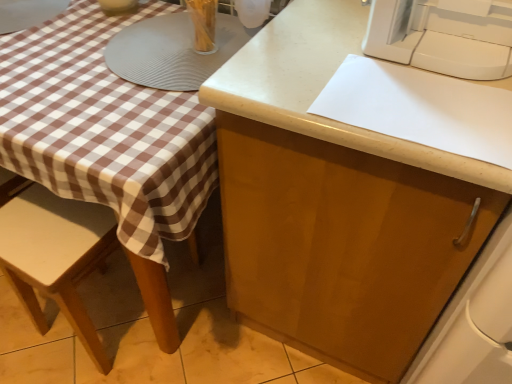
Locate an element on the screen. This screenshot has height=384, width=512. wooden chair at lower left is located at coordinates (55, 254).

What do you see at coordinates (342, 245) in the screenshot? Image resolution: width=512 pixels, height=384 pixels. I see `matte wood cabinet at center` at bounding box center [342, 245].

You are a GUI agent. You are given a task and a screenshot of the screen. Output one action in this format:
    pyautogui.click(x=<x>, y=<y>)
    Task: Click on the matte wood cabinet at center
    
    Given the screenshot: What is the action you would take?
    pyautogui.click(x=342, y=245)

Locate an element on the screen. Image resolution: width=512 pixels, height=384 pixels. white plastic sewing machine at upper right is located at coordinates (441, 38).

Is matte wood cabinet at center situated inside wooden chair at lower left or outside?

matte wood cabinet at center lies outside wooden chair at lower left.

Is matte wood cabinet at center at the right side of wooden chair at lower left?

Correct, you'll find matte wood cabinet at center to the right of wooden chair at lower left.

Are matte wood cabinet at center and wooden chair at lower left far apart?

No, there isn't a large distance between matte wood cabinet at center and wooden chair at lower left.

Is matte wood cabinet at center oriented towards wooden chair at lower left?

No, matte wood cabinet at center is not aimed at wooden chair at lower left.

Is wooden chair at lower left next to white plastic sewing machine at upper right?

wooden chair at lower left and white plastic sewing machine at upper right are clearly separated.

Is point (38, 329) positioned in front of point (389, 9)?

No.

Considering the relative sizes of wooden chair at lower left and white plastic sewing machine at upper right in the image provided, is wooden chair at lower left smaller than white plastic sewing machine at upper right?

Actually, wooden chair at lower left might be larger than white plastic sewing machine at upper right.

Between matte wood cabinet at center and white plastic sewing machine at upper right, which one has larger size?

Bigger between the two is matte wood cabinet at center.

Looking at this image, from a real-world perspective, is matte wood cabinet at center above or below white plastic sewing machine at upper right?

From a real-world perspective, matte wood cabinet at center is physically below white plastic sewing machine at upper right.

Is point (438, 204) behind point (480, 42)?

No, (438, 204) is in front of (480, 42).

The image size is (512, 384). Find the location of `sewing machine on the right of matte wood cabinet at center`. sewing machine on the right of matte wood cabinet at center is located at coordinates (441, 38).

Is white plastic sewing machine at upper right not near matte wood cabinet at center?

white plastic sewing machine at upper right is actually quite close to matte wood cabinet at center.

Considering the relative positions of white plastic sewing machine at upper right and matte wood cabinet at center in the image provided, is white plastic sewing machine at upper right to the left or to the right of matte wood cabinet at center?

Based on their positions, white plastic sewing machine at upper right is located to the right of matte wood cabinet at center.

Is white plastic sewing machine at upper right facing towards matte wood cabinet at center?

No, white plastic sewing machine at upper right is not turned towards matte wood cabinet at center.

In terms of width, does white plastic sewing machine at upper right look wider or thinner when compared to matte wood cabinet at center?

In the image, white plastic sewing machine at upper right appears to be more narrow than matte wood cabinet at center.

Considering the sizes of objects white plastic sewing machine at upper right and wooden chair at lower left in the image provided, who is shorter, white plastic sewing machine at upper right or wooden chair at lower left?

With less height is white plastic sewing machine at upper right.

Considering the relative positions of white plastic sewing machine at upper right and wooden chair at lower left in the image provided, is white plastic sewing machine at upper right to the left or to the right of wooden chair at lower left?

Clearly, white plastic sewing machine at upper right is on the right of wooden chair at lower left in the image.

From a real-world perspective, is white plastic sewing machine at upper right below wooden chair at lower left?

No.

Is wooden chair at lower left bigger or smaller than matte wood cabinet at center?

Clearly, wooden chair at lower left is smaller in size than matte wood cabinet at center.

Between wooden chair at lower left and matte wood cabinet at center, which one has larger width?

matte wood cabinet at center is wider.

From the image's perspective, is wooden chair at lower left over matte wood cabinet at center?

No, from the image's perspective, wooden chair at lower left is not above matte wood cabinet at center.

From a real-world perspective, is wooden chair at lower left on matte wood cabinet at center?

Actually, wooden chair at lower left is physically below matte wood cabinet at center in the real world.

This screenshot has width=512, height=384. What are the coordinates of `chair on the left side of matte wood cabinet at center` in the screenshot? It's located at (55, 254).

Identify the location of sewing machine that appears on the right of wooden chair at lower left. (441, 38).

Based on their spatial positions, is wooden chair at lower left or matte wood cabinet at center further from white plastic sewing machine at upper right?

Based on the image, wooden chair at lower left appears to be further to white plastic sewing machine at upper right.

Estimate the real-world distances between objects in this image. Which object is further from wooden chair at lower left, white plastic sewing machine at upper right or matte wood cabinet at center?

Among the two, white plastic sewing machine at upper right is located further to wooden chair at lower left.

Based on their spatial positions, is matte wood cabinet at center or wooden chair at lower left closer to white plastic sewing machine at upper right?

Among the two, matte wood cabinet at center is located nearer to white plastic sewing machine at upper right.

From the image, which object appears to be nearer to wooden chair at lower left, matte wood cabinet at center or white plastic sewing machine at upper right?

Based on the image, matte wood cabinet at center appears to be nearer to wooden chair at lower left.

Estimate the real-world distances between objects in this image. Which object is closer to matte wood cabinet at center, wooden chair at lower left or white plastic sewing machine at upper right?

white plastic sewing machine at upper right is positioned closer to the anchor matte wood cabinet at center.

Estimate the real-world distances between objects in this image. Which object is further from matte wood cabinet at center, white plastic sewing machine at upper right or wooden chair at lower left?

Among the two, wooden chair at lower left is located further to matte wood cabinet at center.

At what (x,y) coordinates should I click in order to perform the action: click on cabinetry between wooden chair at lower left and white plastic sewing machine at upper right in the horizontal direction. Please return your answer as a coordinate pair (x, y). This screenshot has width=512, height=384. Looking at the image, I should click on (342, 245).